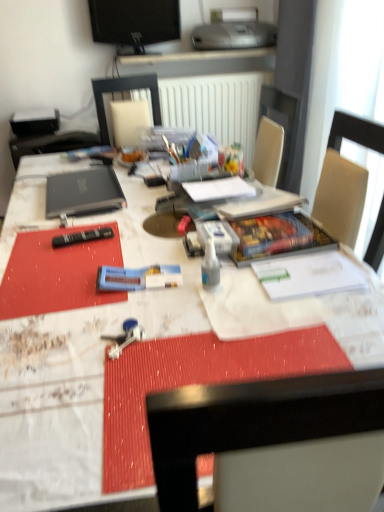
Question: Should I look upward or downward to see silver metallic printer at upper center?

Choices:
 (A) up
 (B) down

Answer: (A)

Question: Does white paper at center appear on the right side of blue plastic toothpaste tube at center?

Choices:
 (A) yes
 (B) no

Answer: (A)

Question: Considering the relative positions of white paper at center and blue plastic toothpaste tube at center in the image provided, is white paper at center behind blue plastic toothpaste tube at center?

Choices:
 (A) yes
 (B) no

Answer: (A)

Question: Is white paper at center turned away from blue plastic toothpaste tube at center?

Choices:
 (A) no
 (B) yes

Answer: (A)

Question: From a real-world perspective, is white paper at center positioned under blue plastic toothpaste tube at center based on gravity?

Choices:
 (A) yes
 (B) no

Answer: (B)

Question: Can you confirm if white paper at center is taller than blue plastic toothpaste tube at center?

Choices:
 (A) yes
 (B) no

Answer: (A)

Question: From the image's perspective, is white paper at center located beneath blue plastic toothpaste tube at center?

Choices:
 (A) yes
 (B) no

Answer: (B)

Question: Is transparent plastic bottle at center directly adjacent to white glossy desk at center?

Choices:
 (A) yes
 (B) no

Answer: (B)

Question: Is transparent plastic bottle at center completely or partially outside of white glossy desk at center?

Choices:
 (A) no
 (B) yes

Answer: (B)

Question: Is white glossy desk at center inside transparent plastic bottle at center?

Choices:
 (A) yes
 (B) no

Answer: (B)

Question: Can you confirm if transparent plastic bottle at center is positioned to the right of white glossy desk at center?

Choices:
 (A) no
 (B) yes

Answer: (B)

Question: Considering the relative sizes of transparent plastic bottle at center and white glossy desk at center in the image provided, is transparent plastic bottle at center wider than white glossy desk at center?

Choices:
 (A) no
 (B) yes

Answer: (A)

Question: Is transparent plastic bottle at center smaller than white glossy desk at center?

Choices:
 (A) yes
 (B) no

Answer: (A)

Question: Does black matte laptop at left appear on the left side of silver metallic printer at upper center?

Choices:
 (A) yes
 (B) no

Answer: (A)